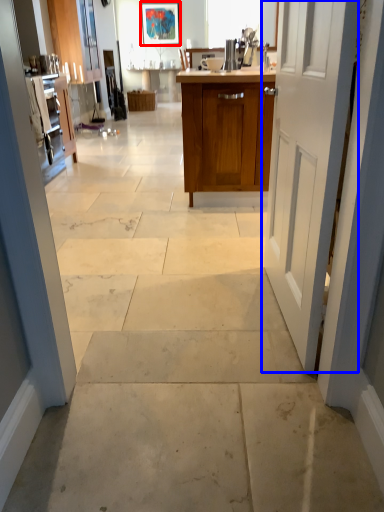
Question: Which object appears closest to the camera in this image, picture frame (highlighted by a red box) or door (highlighted by a blue box)?

Choices:
 (A) picture frame
 (B) door

Answer: (B)